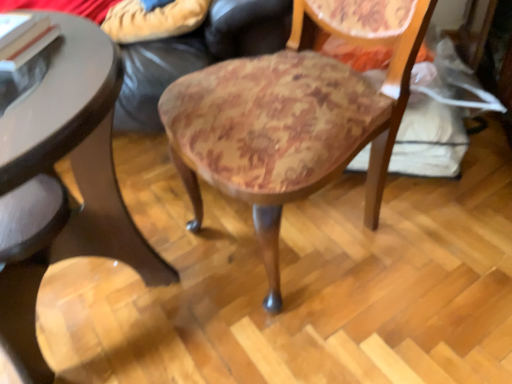
Question: From a real-world perspective, is wooden upholstered chair at center on top of wooden round table at lower left?

Choices:
 (A) no
 (B) yes

Answer: (B)

Question: Is wooden upholstered chair at center at the left side of wooden round table at lower left?

Choices:
 (A) no
 (B) yes

Answer: (A)

Question: Is the depth of wooden upholstered chair at center less than that of wooden round table at lower left?

Choices:
 (A) yes
 (B) no

Answer: (B)

Question: Considering the relative sizes of wooden upholstered chair at center and wooden round table at lower left in the image provided, is wooden upholstered chair at center taller than wooden round table at lower left?

Choices:
 (A) no
 (B) yes

Answer: (B)

Question: Is wooden upholstered chair at center turned away from wooden round table at lower left?

Choices:
 (A) yes
 (B) no

Answer: (B)

Question: Considering the relative positions of wooden upholstered chair at center and wooden round table at lower left in the image provided, is wooden upholstered chair at center to the right of wooden round table at lower left from the viewer's perspective?

Choices:
 (A) yes
 (B) no

Answer: (A)

Question: From a real-world perspective, is wooden upholstered chair at center physically above leather couch at center?

Choices:
 (A) yes
 (B) no

Answer: (A)

Question: Is wooden upholstered chair at center to the right of leather couch at center from the viewer's perspective?

Choices:
 (A) no
 (B) yes

Answer: (B)

Question: From the image's perspective, is wooden upholstered chair at center over leather couch at center?

Choices:
 (A) yes
 (B) no

Answer: (B)

Question: From a real-world perspective, does wooden upholstered chair at center sit lower than leather couch at center?

Choices:
 (A) yes
 (B) no

Answer: (B)

Question: Is the surface of wooden upholstered chair at center in direct contact with leather couch at center?

Choices:
 (A) no
 (B) yes

Answer: (A)

Question: Can you confirm if wooden upholstered chair at center is bigger than leather couch at center?

Choices:
 (A) yes
 (B) no

Answer: (B)

Question: Is wooden round table at lower left at the right side of wooden upholstered chair at center?

Choices:
 (A) no
 (B) yes

Answer: (A)